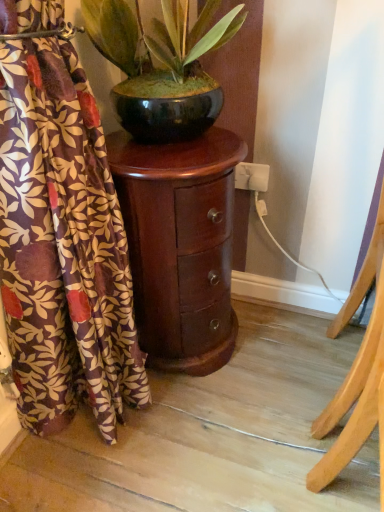
The width and height of the screenshot is (384, 512). Describe the element at coordinates (162, 65) in the screenshot. I see `shiny black pot at upper center` at that location.

Measure the distance between shiny dark wood nightstand at center and camera.

They are 36.08 inches apart.

In order to face light wood easel at right, should I rotate leftwards or rightwards?

A 23.872 degree turn to the right will do.

This screenshot has height=512, width=384. In order to click on light wood easel at right in this screenshot , I will do `click(356, 370)`.

The width and height of the screenshot is (384, 512). What do you see at coordinates (62, 246) in the screenshot?
I see `matte floral curtain at left` at bounding box center [62, 246].

Identify the location of shiny black pot at upper center. (162, 65).

The height and width of the screenshot is (512, 384). In order to click on houseplant lying on the right of shiny dark wood nightstand at center in this screenshot , I will do `click(162, 65)`.

From a real-world perspective, is shiny black pot at upper center above or below shiny dark wood nightstand at center?

In terms of real-world spatial position, shiny black pot at upper center is above shiny dark wood nightstand at center.

Is shiny black pot at upper center inside or outside of shiny dark wood nightstand at center?

shiny black pot at upper center is spatially situated outside shiny dark wood nightstand at center.

Considering the sizes of objects shiny dark wood nightstand at center and matte floral curtain at left in the image provided, who is wider, shiny dark wood nightstand at center or matte floral curtain at left?

shiny dark wood nightstand at center.

Could matte floral curtain at left be considered to be inside shiny dark wood nightstand at center?

Actually, matte floral curtain at left is outside shiny dark wood nightstand at center.

Considering the relative sizes of shiny dark wood nightstand at center and matte floral curtain at left in the image provided, is shiny dark wood nightstand at center smaller than matte floral curtain at left?

Yes, shiny dark wood nightstand at center is smaller than matte floral curtain at left.

Based on the photo, from the image's perspective, is shiny dark wood nightstand at center below matte floral curtain at left?

No, from the image's perspective, shiny dark wood nightstand at center is not below matte floral curtain at left.

Which is closer, (201, 317) or (381, 231)?

Point (201, 317) is positioned farther from the camera compared to point (381, 231).

Is shiny dark wood nightstand at center completely or partially outside of light wood easel at right?

shiny dark wood nightstand at center lies outside light wood easel at right's area.

Which object is wider, shiny dark wood nightstand at center or light wood easel at right?

Wider between the two is shiny dark wood nightstand at center.

Which object is more forward, light wood easel at right or shiny dark wood nightstand at center?

Positioned in front is light wood easel at right.

From a real-world perspective, between light wood easel at right and shiny dark wood nightstand at center, who is vertically higher?

From a 3D spatial view, light wood easel at right is above.

Is light wood easel at right located outside shiny dark wood nightstand at center?

Yes.

Is light wood easel at right taller than shiny dark wood nightstand at center?

Yes, light wood easel at right is taller than shiny dark wood nightstand at center.

Considering the positions of objects shiny black pot at upper center and matte floral curtain at left in the image provided, who is more to the right, shiny black pot at upper center or matte floral curtain at left?

shiny black pot at upper center.

From the image's perspective, which is above, shiny black pot at upper center or matte floral curtain at left?

From the image's view, shiny black pot at upper center is above.

Which object is wider, shiny black pot at upper center or matte floral curtain at left?

With larger width is shiny black pot at upper center.

Are shiny black pot at upper center and matte floral curtain at left far apart?

shiny black pot at upper center is actually quite close to matte floral curtain at left.

Is light wood easel at right looking in the opposite direction of matte floral curtain at left?

Correct, light wood easel at right is looking away from matte floral curtain at left.

From a real-world perspective, is light wood easel at right positioned above or below matte floral curtain at left?

From a real-world perspective, light wood easel at right is physically below matte floral curtain at left.

Considering the relative sizes of light wood easel at right and matte floral curtain at left in the image provided, is light wood easel at right taller than matte floral curtain at left?

Yes, light wood easel at right is taller than matte floral curtain at left.

Looking at this image, from the image's perspective, relative to matte floral curtain at left, is light wood easel at right above or below?

Clearly, from the image's perspective, light wood easel at right is above matte floral curtain at left.

Does matte floral curtain at left have a greater width compared to light wood easel at right?

Result: Yes, matte floral curtain at left is wider than light wood easel at right.

In the scene shown: Can you confirm if matte floral curtain at left is shorter than light wood easel at right?

Correct, matte floral curtain at left is not as tall as light wood easel at right.

Is point (49, 267) farther from viewer compared to point (349, 385)?

Yes, point (49, 267) is behind point (349, 385).

Find the location of a particular element. The image size is (384, 512). furniture below the matte floral curtain at left (from a real-world perspective) is located at coordinates (356, 370).

This screenshot has width=384, height=512. What are the coordinates of `houseplant above the shiny dark wood nightstand at center (from a real-world perspective)` in the screenshot? It's located at (162, 65).

I want to click on nightstand located behind the matte floral curtain at left, so pyautogui.click(x=180, y=245).

When comparing their distances from shiny dark wood nightstand at center, does light wood easel at right or matte floral curtain at left seem closer?

matte floral curtain at left lies closer to shiny dark wood nightstand at center than the other object.

Which object lies further to the anchor point shiny dark wood nightstand at center, light wood easel at right or shiny black pot at upper center?

Based on the image, light wood easel at right appears to be further to shiny dark wood nightstand at center.

Estimate the real-world distances between objects in this image. Which object is closer to light wood easel at right, shiny black pot at upper center or matte floral curtain at left?

The object closer to light wood easel at right is matte floral curtain at left.

Which object lies further to the anchor point shiny black pot at upper center, matte floral curtain at left or light wood easel at right?

The object further to shiny black pot at upper center is light wood easel at right.

From the image, which object appears to be farther from shiny dark wood nightstand at center, matte floral curtain at left or light wood easel at right?

The object further to shiny dark wood nightstand at center is light wood easel at right.

When comparing their distances from shiny black pot at upper center, does shiny dark wood nightstand at center or matte floral curtain at left seem closer?

shiny dark wood nightstand at center is closer to shiny black pot at upper center.

Based on their spatial positions, is shiny dark wood nightstand at center or matte floral curtain at left further from light wood easel at right?

matte floral curtain at left is further to light wood easel at right.

In the scene shown: Looking at the image, which one is located further to shiny dark wood nightstand at center, matte floral curtain at left or shiny black pot at upper center?

Among the two, shiny black pot at upper center is located further to shiny dark wood nightstand at center.

At what (x,y) coordinates should I click in order to perform the action: click on houseplant located between shiny dark wood nightstand at center and light wood easel at right in the left-right direction. Please return your answer as a coordinate pair (x, y). This screenshot has height=512, width=384. Looking at the image, I should click on (162, 65).

At what (x,y) coordinates should I click in order to perform the action: click on nightstand between shiny black pot at upper center and matte floral curtain at left vertically. Please return your answer as a coordinate pair (x, y). The image size is (384, 512). Looking at the image, I should click on (180, 245).

Where is `houseplant situated between matte floral curtain at left and light wood easel at right from left to right`? This screenshot has width=384, height=512. houseplant situated between matte floral curtain at left and light wood easel at right from left to right is located at coordinates (162, 65).

I want to click on nightstand located between matte floral curtain at left and light wood easel at right in the left-right direction, so click(180, 245).